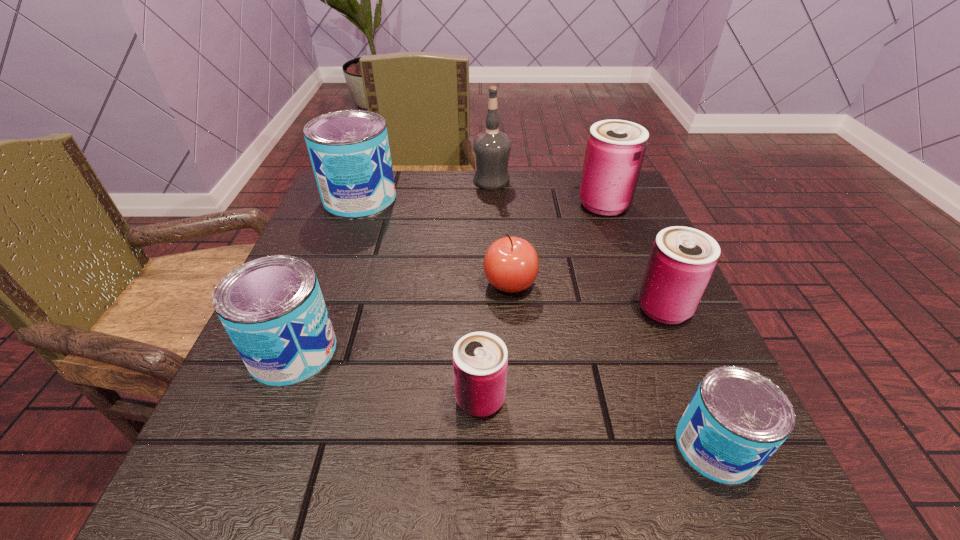
Identify the location of vacant region between the farthest blue can and the leftmost pink can. (420, 299).

Identify the location of free space between the nearest pink can and the smallest blue can. (598, 423).

At what (x,y) coordinates should I click in order to perform the action: click on object that can be found as the fifth closest to the second farthest pink can. Please return your answer as a coordinate pair (x, y). This screenshot has width=960, height=540. Looking at the image, I should click on (491, 148).

Select which object is the seventh closest to the apple. Please provide its 2D coordinates. Your answer should be formatted as a tuple, i.e. [(x, y)], where the tuple contains the x and y coordinates of a point satisfying the conditions above.

[(491, 148)]

Select which can appears as the third closest to the second biggest pink can. Please provide its 2D coordinates. Your answer should be formatted as a tuple, i.e. [(x, y)], where the tuple contains the x and y coordinates of a point satisfying the conditions above.

[(480, 359)]

Select which can is the fourth closest to the second biggest blue can. Please provide its 2D coordinates. Your answer should be formatted as a tuple, i.e. [(x, y)], where the tuple contains the x and y coordinates of a point satisfying the conditions above.

[(682, 259)]

The height and width of the screenshot is (540, 960). What are the coordinates of `blue can that can be found as the closest to the nearest blue can` in the screenshot? It's located at (272, 308).

The image size is (960, 540). I want to click on blue can object that ranks as the second closest to the second smallest pink can, so click(272, 308).

At what (x,y) coordinates should I click in order to perform the action: click on pink can that is the nearest to the second biggest blue can. Please return your answer as a coordinate pair (x, y). Image resolution: width=960 pixels, height=540 pixels. Looking at the image, I should click on (480, 359).

Locate which pink can ranks third in proximity to the apple. Please provide its 2D coordinates. Your answer should be formatted as a tuple, i.e. [(x, y)], where the tuple contains the x and y coordinates of a point satisfying the conditions above.

[(615, 150)]